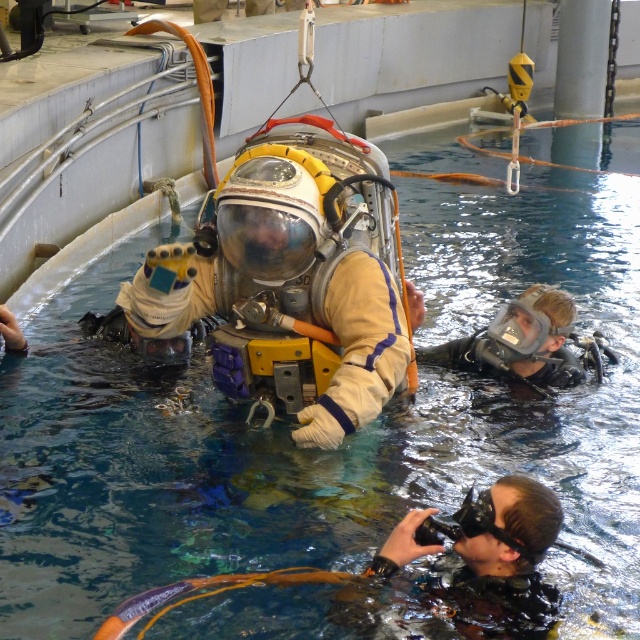
You are a safety inspector checking equipment in the training pool. You see the black rubber camera at lower right and the clear plastic mask at lower right. Which equipment is narrower in width?

The black rubber camera at lower right has a lesser width compared to the clear plastic mask at lower right, so the black rubber camera at lower right is narrower in width.